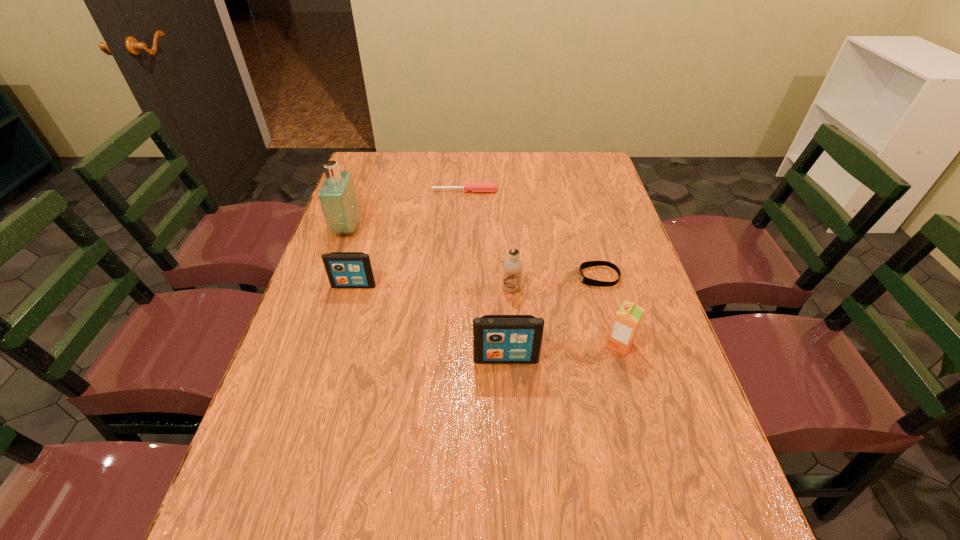
Identify the location of the shortest object. This screenshot has width=960, height=540. (587, 281).

The width and height of the screenshot is (960, 540). I want to click on free space located 0.240m on the front screen of the shorter iPod, so click(x=331, y=364).

The height and width of the screenshot is (540, 960). What are the coordinates of `vacant area located 0.150m on the front screen of the nearer iPod` in the screenshot? It's located at (510, 426).

The height and width of the screenshot is (540, 960). I want to click on vacant area situated on the right of the chocolate milk, so click(565, 288).

The height and width of the screenshot is (540, 960). I want to click on free point located 0.240m on the right of the screwdriver, so click(x=567, y=191).

Identify the location of vacant space situated on the front label of the second farthest object. (460, 228).

At what (x,y) coordinates should I click in order to perform the action: click on vacant area situated 0.070m on the left of the orange juice. Please return your answer as a coordinate pair (x, y). This screenshot has height=540, width=960. Looking at the image, I should click on (576, 345).

In order to click on free space located 0.310m on the display of the wristband in this screenshot , I will do `click(465, 277)`.

This screenshot has width=960, height=540. Identify the location of vacant space located 0.290m on the display of the wristband. (472, 277).

At what (x,y) coordinates should I click in order to perform the action: click on vacant space situated on the display of the wristband. Please return your answer as a coordinate pair (x, y). Image resolution: width=960 pixels, height=540 pixels. Looking at the image, I should click on (458, 277).